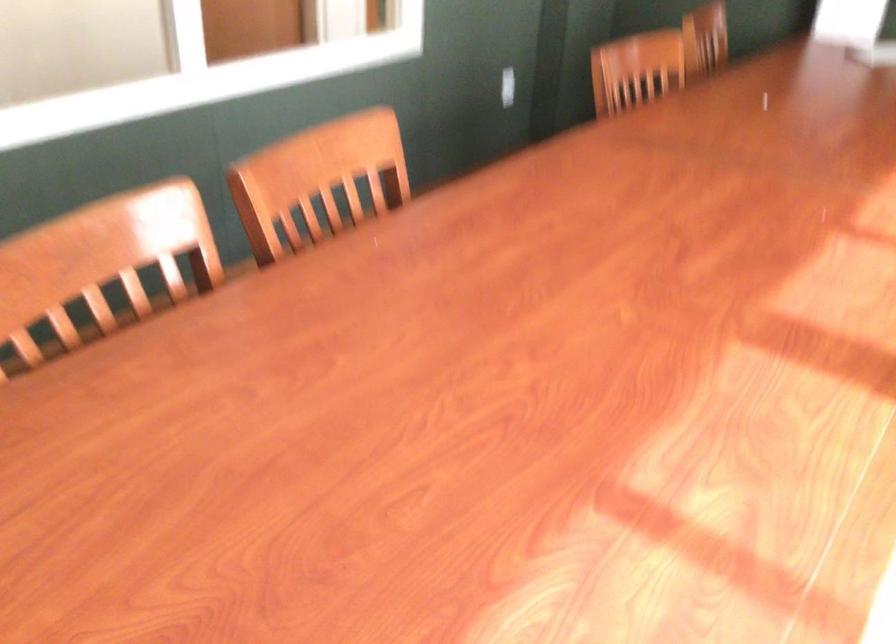
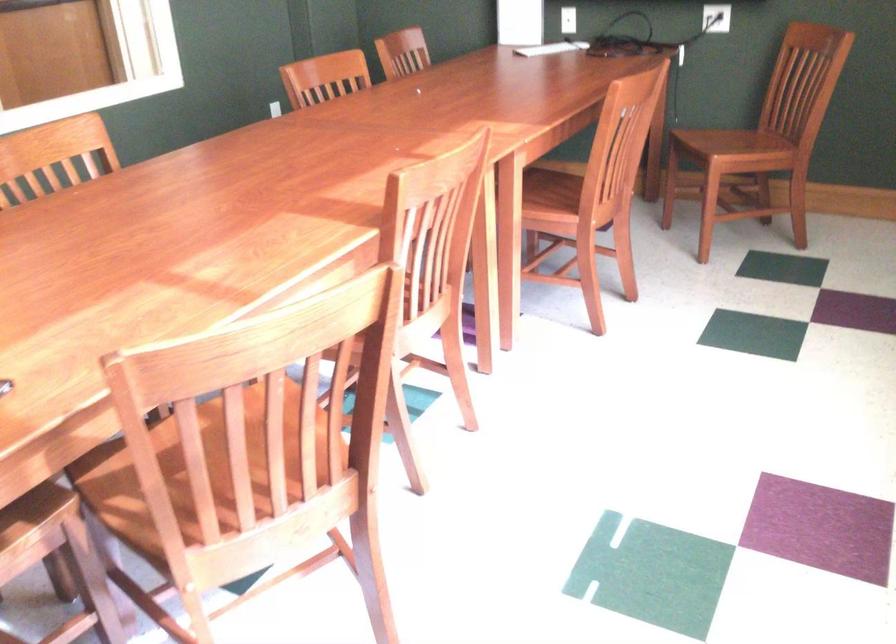
The images are taken continuously from a first-person perspective. In which direction are you moving?

The cameraman moved toward right, backward.